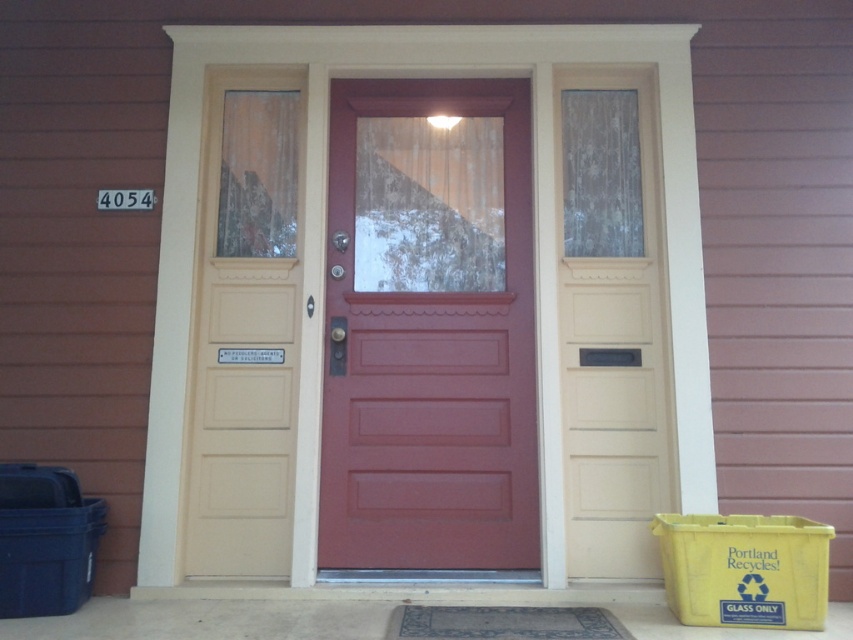
You are standing at the entrance of the house and need to place a package on the ground. The package is too heavy to lift, so you must slide it along the floor. The package is currently at the matte red door at center. Which direction should you push it to move it towards the yellow recycling bin on the right side of the door?

The yellow recycling bin on the right side of the door is positioned to the right of the matte red door at center. Since the package is at the door, pushing it to the right would move it towards the recycling bin.

You are standing in front of the house entrance and want to find the matte red door at center. According to the coordinates provided, where should you look?

The matte red door at center is located at point coordinates (428, 328).

You are a delivery person approaching the entrance of a house with a red door. You need to deliver a package to the correct door. The house has two doors described as matte red door at center and matte cream door at center. According to the scene description, which door is positioned higher up?

The matte cream door at center is positioned higher up since it is above the matte red door at center.